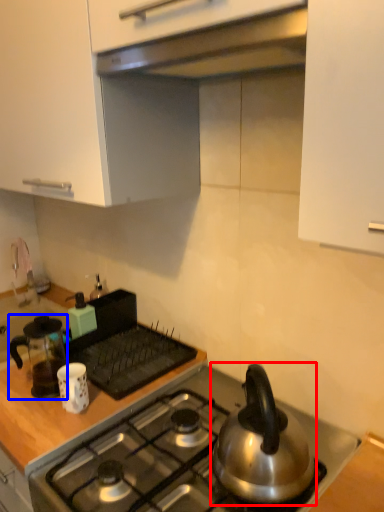
Question: Which of the following is the closest to the observer, kettle (highlighted by a red box) or kitchen appliance (highlighted by a blue box)?

Choices:
 (A) kettle
 (B) kitchen appliance

Answer: (A)